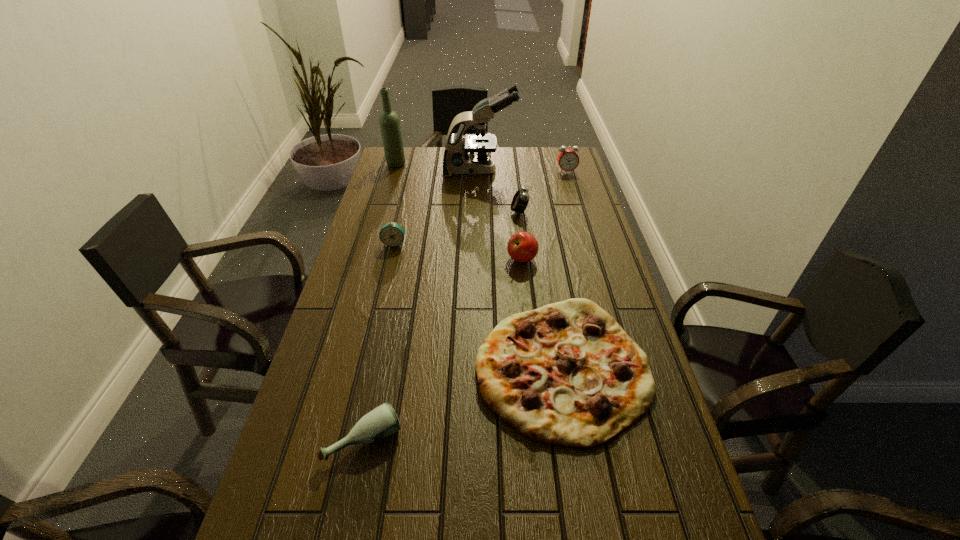
This screenshot has height=540, width=960. I want to click on free space located 0.120m through the eyepieces of the microscope, so click(x=544, y=171).

Image resolution: width=960 pixels, height=540 pixels. What are the coordinates of `free spot located 0.380m on the front of the wine bottle` in the screenshot? It's located at (378, 222).

In order to click on free space located 0.360m on the front-facing side of the rightmost alarm clock in this screenshot , I will do `click(583, 228)`.

This screenshot has height=540, width=960. Find the location of `free space located 0.360m on the face of the second alarm clock from left to right`. free space located 0.360m on the face of the second alarm clock from left to right is located at coordinates (409, 212).

Where is `vacant space situated on the face of the second alarm clock from left to right`? vacant space situated on the face of the second alarm clock from left to right is located at coordinates (460, 212).

You are a GUI agent. You are given a task and a screenshot of the screen. Output one action in this format:
    pyautogui.click(x=<x>, y=<y>)
    Task: Click on the vacant region located on the face of the second alarm clock from left to right
    The width and height of the screenshot is (960, 540).
    Given the screenshot: What is the action you would take?
    pyautogui.click(x=441, y=212)

Identify the location of vacant space located on the front of the apple. This screenshot has height=540, width=960. (533, 363).

Find the location of a particular element. vacant space located on the front-facing side of the fifth farthest object is located at coordinates (385, 282).

You are a GUI agent. You are given a task and a screenshot of the screen. Output one action in this format:
    pyautogui.click(x=<x>, y=<y>)
    Task: Click on the vacant region located on the back of the seventh tallest object
    The image size is (960, 540).
    Given the screenshot: What is the action you would take?
    pyautogui.click(x=373, y=393)

I want to click on vacant point located on the left of the shortest object, so click(x=430, y=367).